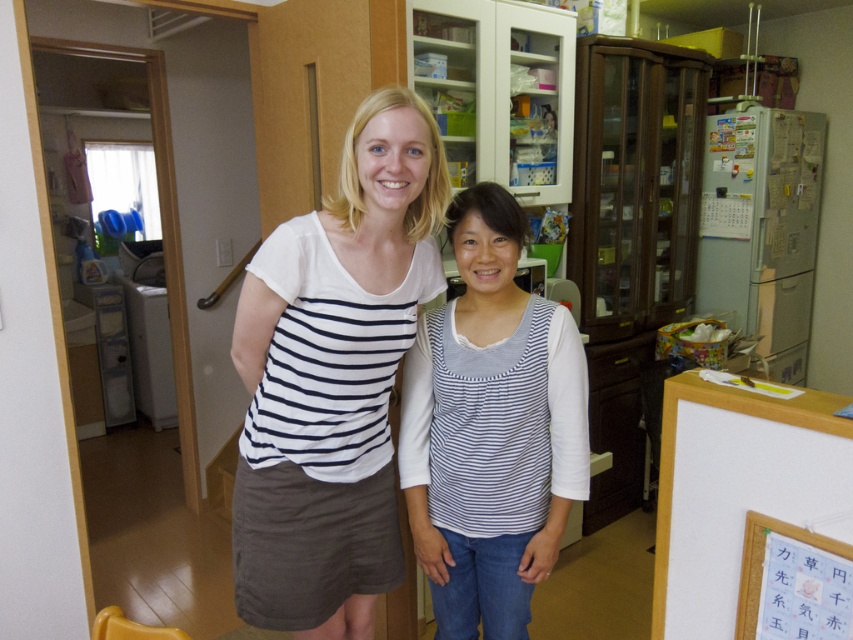
Who is more distant from viewer, (257, 595) or (466, 472)?

Point (466, 472)

What do you see at coordinates (334, 378) in the screenshot? This screenshot has height=640, width=853. I see `white cotton shirt at center` at bounding box center [334, 378].

Is point (355, 205) behind point (502, 627)?

No, it is not.

Find the location of `white cotton shirt at center`. white cotton shirt at center is located at coordinates (334, 378).